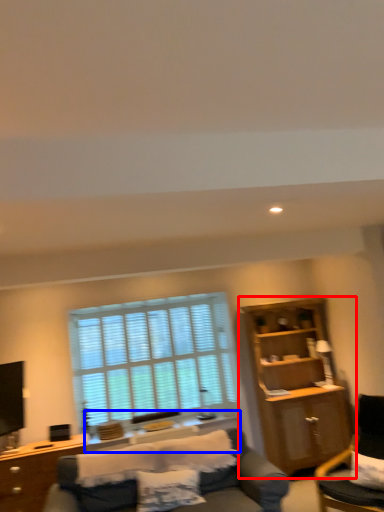
Question: Which of the following is the closest to the observer, cabinetry (highlighted by a red box) or side table (highlighted by a blue box)?

Choices:
 (A) cabinetry
 (B) side table

Answer: (A)